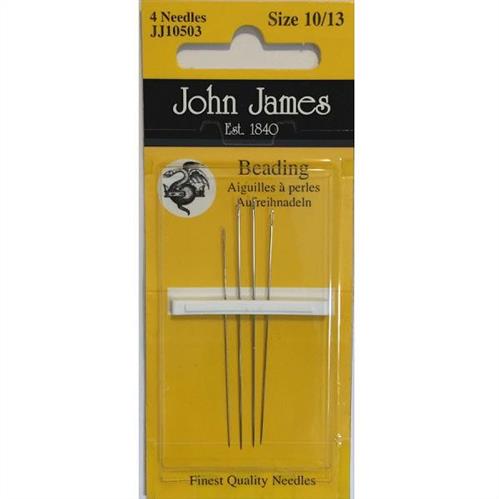
Locate an element on the screen. hole to hang on shelf is located at coordinates (243, 52).